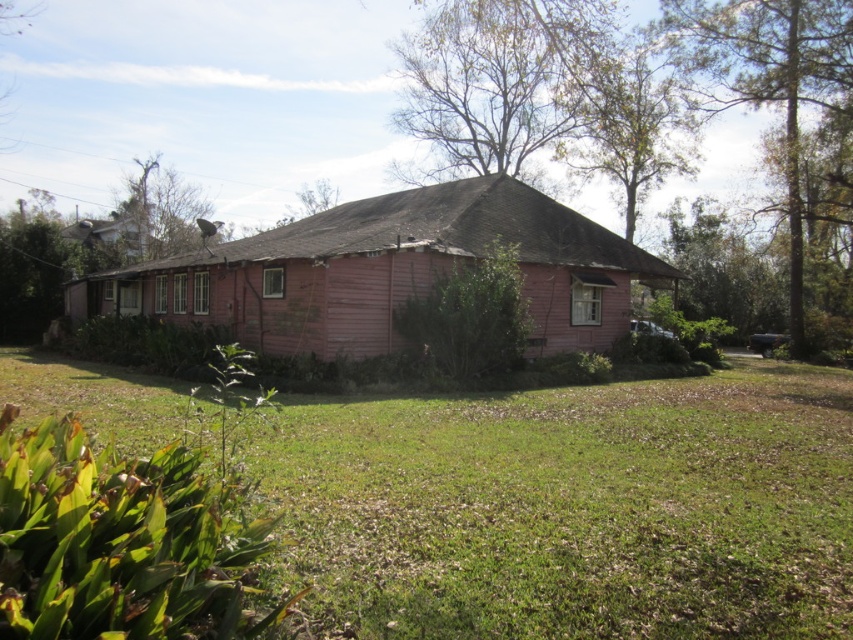
You are standing at the entrance of the house and want to walk to the green grass at lower center. According to the coordinates provided, in which direction should you move relative to the house?

The green grass at lower center is located at point coordinates, so you should move towards the lower center direction relative to the house.

You are standing in front of the house and notice the green grass at lower center and the bare wood tree at upper center. Which of these two objects is located to the left of the other?

The green grass at lower center is positioned on the left side of the bare wood tree at upper center.

Looking at this image, you are a gardener planning to trim the green leafy tree at upper right and the green leafy bush at center. Based on their sizes, which one do you think requires a ladder?

The green leafy tree at upper right is taller than the green leafy bush at center, so you will need a ladder to trim the green leafy tree at upper right.